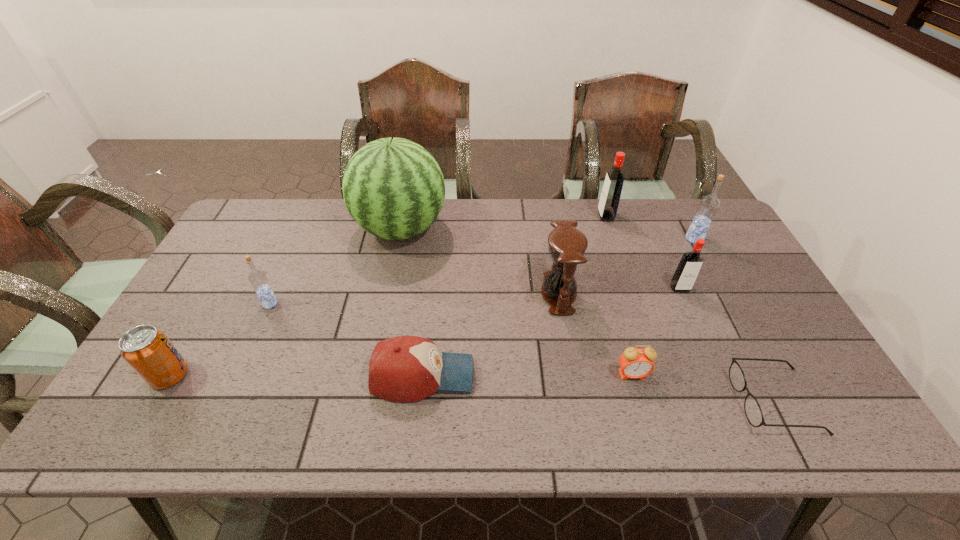
Image resolution: width=960 pixels, height=540 pixels. I want to click on the left blue vodka, so click(258, 279).

You are a GUI agent. You are given a task and a screenshot of the screen. Output one action in this format:
    pyautogui.click(x=<x>, y=<y>)
    Task: Click on the ninth object from right to left
    This screenshot has height=540, width=960.
    Given the screenshot: What is the action you would take?
    pyautogui.click(x=258, y=279)

The width and height of the screenshot is (960, 540). What are the coordinates of `the leftmost object` in the screenshot? It's located at (147, 350).

Identify the location of the fourth shortest object. (147, 350).

Where is `the sixth object from left to right`? the sixth object from left to right is located at coordinates point(634,363).

Where is `alarm clock`? The width and height of the screenshot is (960, 540). alarm clock is located at coordinates (634, 363).

Identify the location of red baseball cap. (405, 368).

Identify the location of the shortest object. The width and height of the screenshot is (960, 540). (753, 412).

I want to click on free point located on the left of the tallest object, so click(322, 229).

The height and width of the screenshot is (540, 960). I want to click on vacant space located on the front and back of the second vodka from left to right, so click(532, 216).